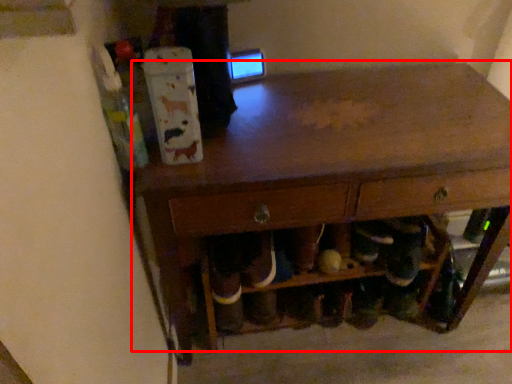
Question: Considering the relative positions of table (annotated by the red box) and shelf in the image provided, where is table (annotated by the red box) located with respect to the staircase?

Choices:
 (A) right
 (B) left

Answer: (A)